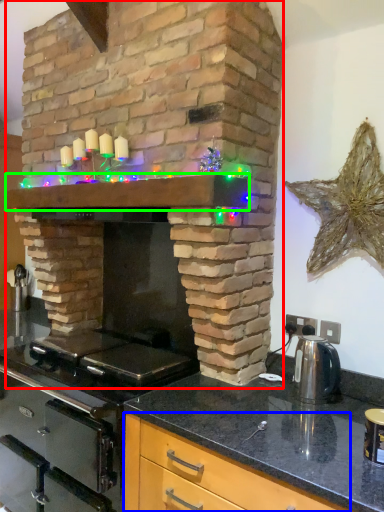
Question: Considering the real-world distances, which object is closest to fireplace (highlighted by a red box)? cabinetry (highlighted by a blue box) or mantle (highlighted by a green box).

Choices:
 (A) cabinetry
 (B) mantle

Answer: (B)